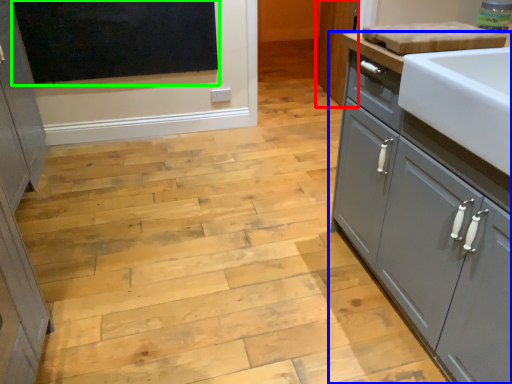
Question: Estimate the real-world distances between objects in this image. Which object is closer to cabinetry (highlighted by a red box), cupboard (highlighted by a blue box) or window screen (highlighted by a green box)?

Choices:
 (A) cupboard
 (B) window screen

Answer: (B)